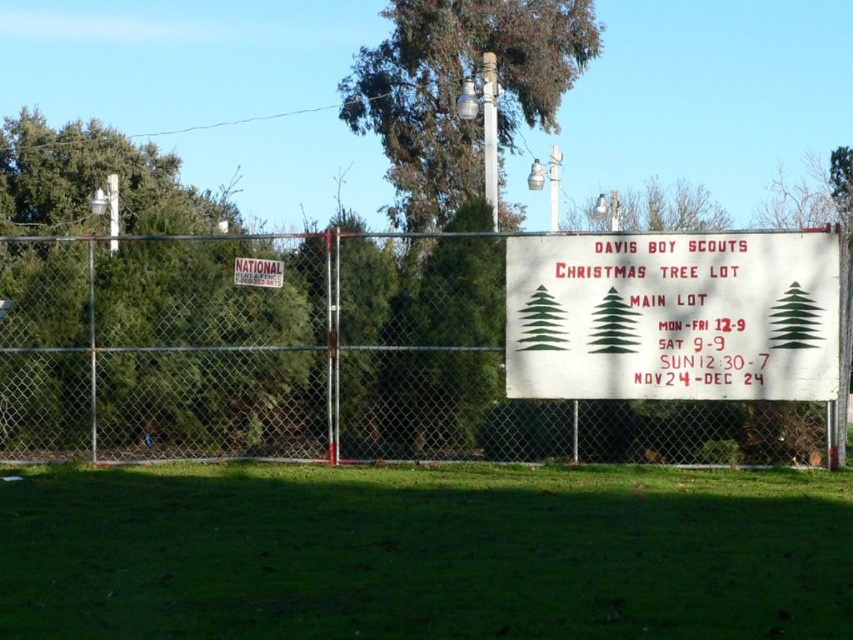
Question: Which object appears closest to the camera in this image?

Choices:
 (A) white paper sign at center
 (B) green grass at lower center
 (C) green leafy tree at upper center
 (D) white metal fence at center

Answer: (B)

Question: Which object is closer to the camera taking this photo?

Choices:
 (A) white plastic sign at upper center
 (B) green leafy tree at upper center
 (C) green grass at lower center
 (D) white paper sign at center

Answer: (C)

Question: Is white metal fence at center to the right of green leafy tree at upper center from the viewer's perspective?

Choices:
 (A) no
 (B) yes

Answer: (B)

Question: Does green grass at lower center appear on the left side of green leafy tree at upper center?

Choices:
 (A) yes
 (B) no

Answer: (A)

Question: Which object is positioned farthest from the white paper sign at center?

Choices:
 (A) white plastic sign at upper center
 (B) white metal fence at center
 (C) green grass at lower center

Answer: (A)

Question: Is the position of white paper sign at center less distant than that of white plastic sign at upper center?

Choices:
 (A) no
 (B) yes

Answer: (B)